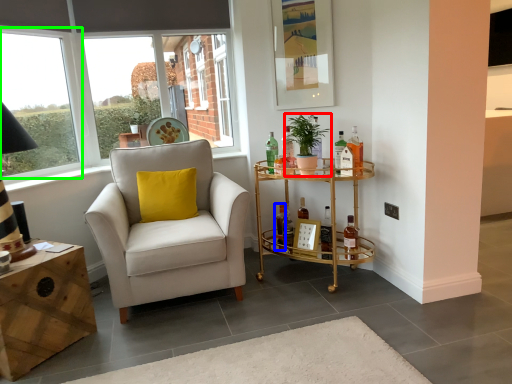
Question: Estimate the real-world distances between objects in this image. Which object is closer to houseplant (highlighted by a red box), bottle (highlighted by a blue box) or window (highlighted by a green box)?

Choices:
 (A) bottle
 (B) window

Answer: (A)